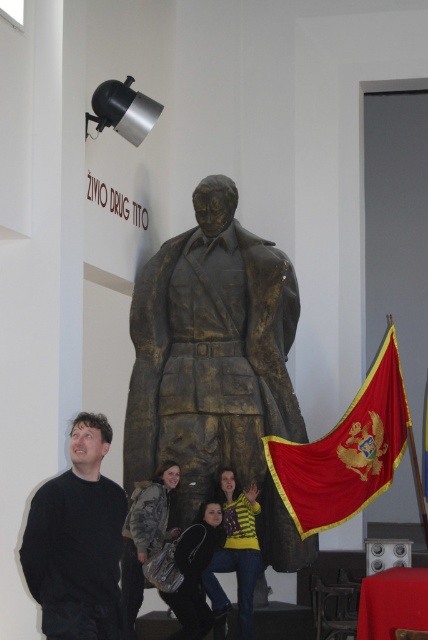
Question: Where is yellow striped sweater at center located in relation to camouflage fabric jacket at lower center in the image?

Choices:
 (A) below
 (B) above

Answer: (B)

Question: Does black matte sweater at left appear on the left side of red velvet flag at center?

Choices:
 (A) yes
 (B) no

Answer: (A)

Question: Which is farther from the red velvet flag at center?

Choices:
 (A) camouflage fabric jacket at lower center
 (B) black leather jacket at lower center
 (C) bronze statue at center

Answer: (A)

Question: Which object appears farthest from the camera in this image?

Choices:
 (A) yellow striped sweater at center
 (B) black matte sweater at left
 (C) black leather jacket at lower center
 (D) bronze statue at center

Answer: (A)

Question: Does red velvet flag at center appear on the right side of black leather jacket at lower center?

Choices:
 (A) no
 (B) yes

Answer: (B)

Question: Which point is farther to the camera?

Choices:
 (A) (162, 465)
 (B) (216, 417)
 (C) (195, 547)
 (D) (403, 451)

Answer: (D)